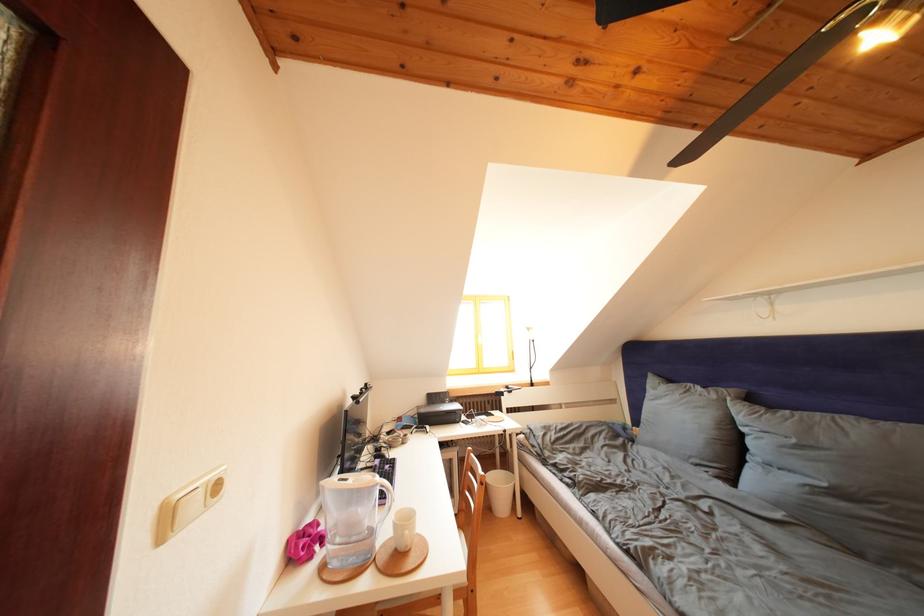
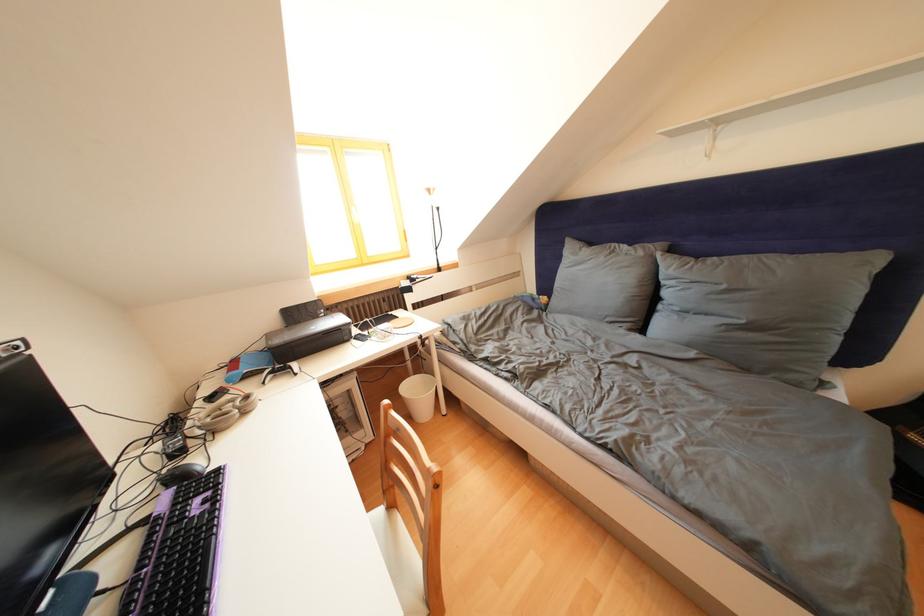
Where in the second image is the point corresponding to [396,438] from the first image?

(220, 403)